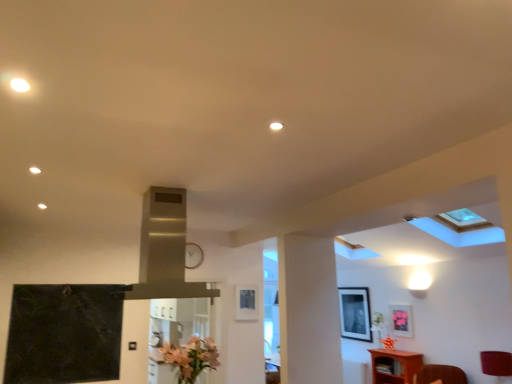
Question: Would you say matte pink picture frame at upper right, which is the first picture frame from right to left, contains metallic clock at center?

Choices:
 (A) yes
 (B) no

Answer: (B)

Question: Is matte pink picture frame at upper right, the 2th picture frame positioned from the back, outside of metallic clock at center?

Choices:
 (A) yes
 (B) no

Answer: (A)

Question: Is matte pink picture frame at upper right, which is the first picture frame from right to left, facing away from metallic clock at center?

Choices:
 (A) yes
 (B) no

Answer: (B)

Question: Is matte pink picture frame at upper right, which is the first picture frame from right to left, bigger than metallic clock at center?

Choices:
 (A) no
 (B) yes

Answer: (B)

Question: Does matte pink picture frame at upper right, which is the 3th picture frame from left to right, have a greater height compared to metallic clock at center?

Choices:
 (A) no
 (B) yes

Answer: (B)

Question: Does matte pink picture frame at upper right, the 2th picture frame positioned from the back, lie behind metallic clock at center?

Choices:
 (A) yes
 (B) no

Answer: (A)

Question: Does pink matte flower at lower center contain matte pink picture frame at upper right, which is the 3th picture frame from left to right?

Choices:
 (A) yes
 (B) no

Answer: (B)

Question: Is pink matte flower at lower center behind matte pink picture frame at upper right, which is the second picture frame from front to back?

Choices:
 (A) no
 (B) yes

Answer: (A)

Question: Is the surface of pink matte flower at lower center in direct contact with matte pink picture frame at upper right, which is the first picture frame from right to left?

Choices:
 (A) no
 (B) yes

Answer: (A)

Question: Considering the relative sizes of pink matte flower at lower center and matte pink picture frame at upper right, which is the first picture frame from right to left, in the image provided, is pink matte flower at lower center wider than matte pink picture frame at upper right, which is the first picture frame from right to left,?

Choices:
 (A) yes
 (B) no

Answer: (A)

Question: Is the depth of pink matte flower at lower center less than that of matte pink picture frame at upper right, which is the 3th picture frame from left to right?

Choices:
 (A) no
 (B) yes

Answer: (B)

Question: From a real-world perspective, is pink matte flower at lower center positioned over matte pink picture frame at upper right, the 2th picture frame positioned from the back, based on gravity?

Choices:
 (A) no
 (B) yes

Answer: (A)

Question: Considering the relative positions of pink matte flower at lower center and matte black picture frame at upper center, the first picture frame from the front, in the image provided, is pink matte flower at lower center behind matte black picture frame at upper center, the first picture frame from the front,?

Choices:
 (A) no
 (B) yes

Answer: (A)